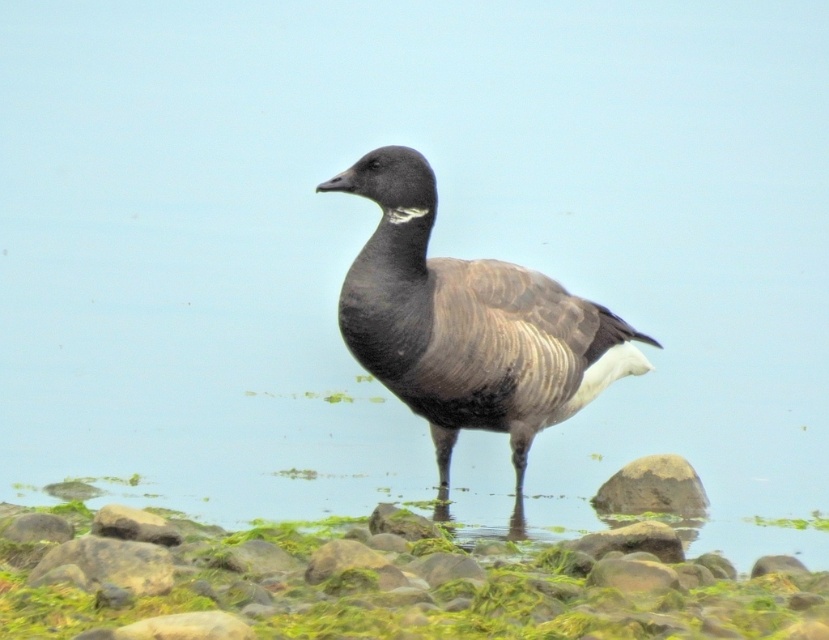
You are a photographer trying to capture the goose in the scene. You notice two points marked in the image. The first point is at coordinate point (x=553, y=636), and the second point is at coordinate point (x=633, y=483). Which of these points is nearer to you, the photographer?

Point (x=553, y=636) is closer to the viewer than point (x=633, y=483), so the first point is nearer to you.

In the scene shown: You are a photographer trying to capture the dark brown feathered duck at center and the smooth gray rock at lower right in the same frame. Based on their sizes, which object should you focus on first to ensure both are in focus?

The dark brown feathered duck at center is taller than the smooth gray rock at lower right, so you should focus on the dark brown feathered duck at center first to ensure both are in focus.

You are a photographer trying to capture the dark brown feathered duck at center and the smooth gray rock at lower right in the same frame. Based on their positions, which object should you focus on first if you want to ensure both are in focus?

The dark brown feathered duck at center is to the left of the smooth gray rock at lower right, so focusing on the duck first will help ensure both are in focus since it is closer to the camera.